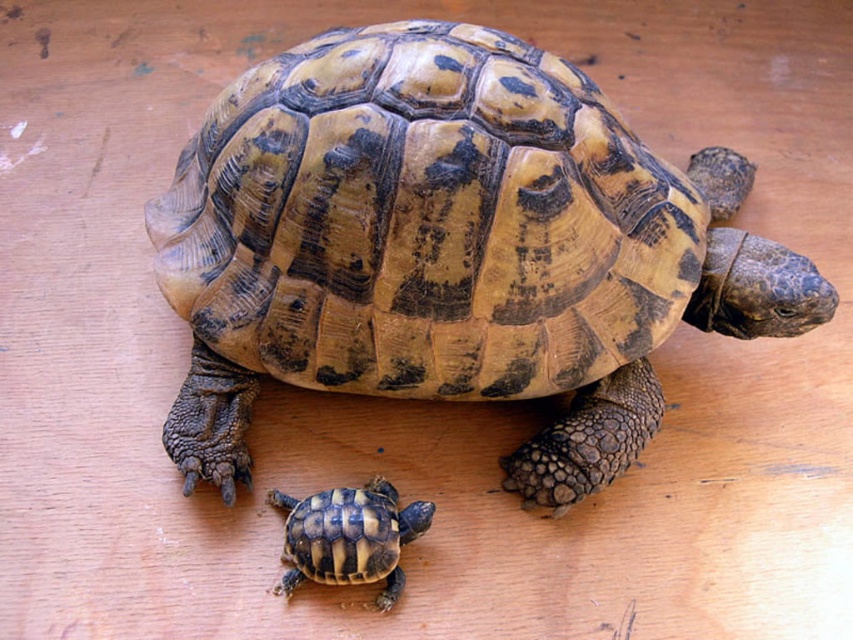
Question: Which point is closer to the camera?

Choices:
 (A) brown textured tortoise at lower center
 (B) yellowish-brown scaly tortoise at center

Answer: (A)

Question: Is yellowish-brown scaly tortoise at center below brown textured tortoise at lower center?

Choices:
 (A) yes
 (B) no

Answer: (B)

Question: Is yellowish-brown scaly tortoise at center positioned behind brown textured tortoise at lower center?

Choices:
 (A) yes
 (B) no

Answer: (A)

Question: Among these points, which one is nearest to the camera?

Choices:
 (A) (283, 582)
 (B) (627, 403)

Answer: (A)

Question: Is yellowish-brown scaly tortoise at center thinner than brown textured tortoise at lower center?

Choices:
 (A) no
 (B) yes

Answer: (A)

Question: Which point is farther to the camera?

Choices:
 (A) (561, 342)
 (B) (367, 502)

Answer: (A)